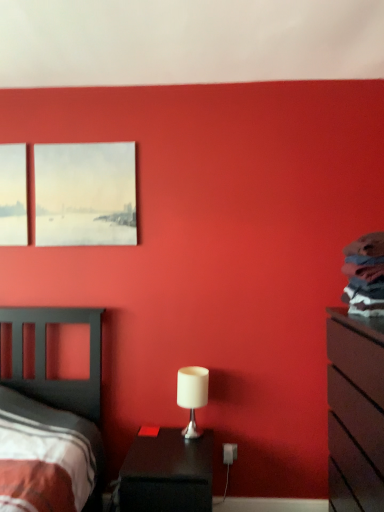
Question: Is white matte table lamp at center looking in the opposite direction of matte black dresser at right?

Choices:
 (A) no
 (B) yes

Answer: (A)

Question: Considering the relative sizes of white matte table lamp at center and matte black dresser at right in the image provided, is white matte table lamp at center shorter than matte black dresser at right?

Choices:
 (A) yes
 (B) no

Answer: (A)

Question: Considering the relative positions of white matte table lamp at center and matte black dresser at right in the image provided, is white matte table lamp at center to the right of matte black dresser at right from the viewer's perspective?

Choices:
 (A) yes
 (B) no

Answer: (B)

Question: Is matte black dresser at right inside white matte table lamp at center?

Choices:
 (A) yes
 (B) no

Answer: (B)

Question: From the image's perspective, is white matte table lamp at center over matte black dresser at right?

Choices:
 (A) yes
 (B) no

Answer: (A)

Question: Does white matte table lamp at center have a greater height compared to matte black dresser at right?

Choices:
 (A) no
 (B) yes

Answer: (A)

Question: Can you confirm if matte black dresser at right is wider than black glossy nightstand at lower center?

Choices:
 (A) yes
 (B) no

Answer: (B)

Question: From the image's perspective, is matte black dresser at right located above black glossy nightstand at lower center?

Choices:
 (A) yes
 (B) no

Answer: (A)

Question: Does matte black dresser at right have a lesser height compared to black glossy nightstand at lower center?

Choices:
 (A) no
 (B) yes

Answer: (A)

Question: Is matte black dresser at right beside black glossy nightstand at lower center?

Choices:
 (A) no
 (B) yes

Answer: (A)

Question: From a real-world perspective, is matte black dresser at right located beneath black glossy nightstand at lower center?

Choices:
 (A) no
 (B) yes

Answer: (A)

Question: Does matte black dresser at right come behind black glossy nightstand at lower center?

Choices:
 (A) no
 (B) yes

Answer: (A)

Question: Does matte canvas painting at upper left have a greater height compared to matte black dresser at right?

Choices:
 (A) no
 (B) yes

Answer: (A)